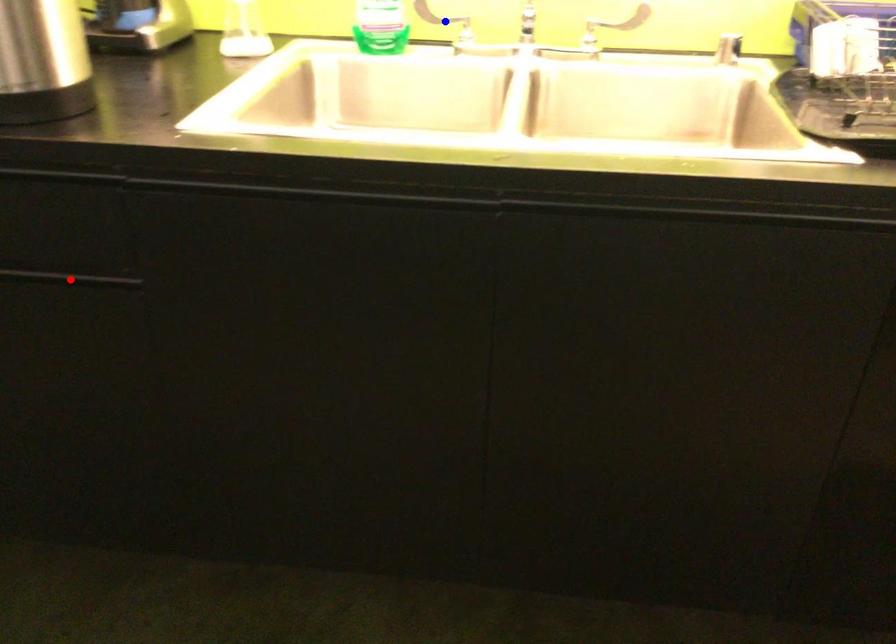
Question: Which of the two points in the image is closer to the camera?

Choices:
 (A) Blue point is closer.
 (B) Red point is closer.

Answer: (B)